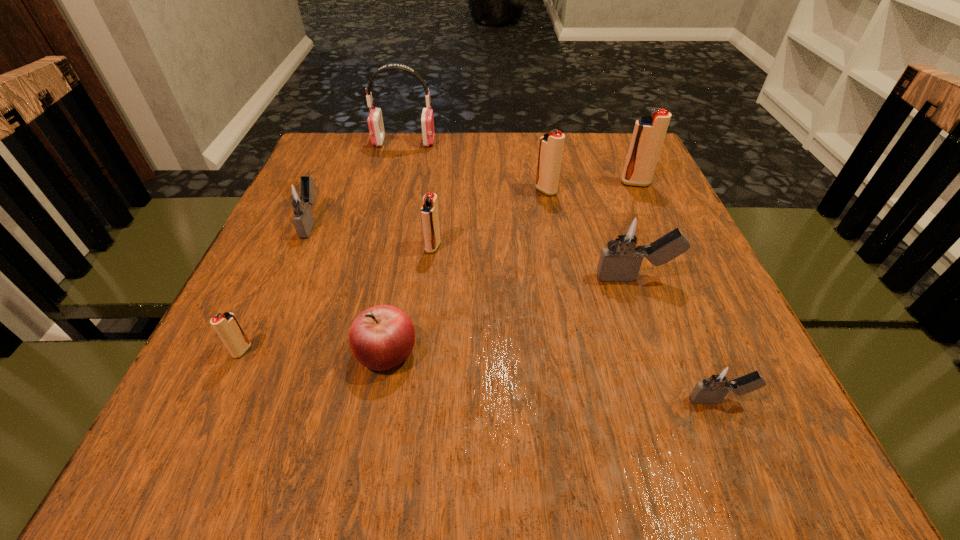
Locate which object ranks eighth in proximity to the fifth farthest igniter. Please provide its 2D coordinates. Your answer should be formatted as a tuple, i.e. [(x, y)], where the tuple contains the x and y coordinates of a point satisfying the conditions above.

[(226, 325)]

Locate an element on the screen. the sixth closest object relative to the nearest object is located at coordinates (226, 325).

Locate an element on the screen. The image size is (960, 540). igniter that can be found as the sixth closest to the second biggest gray igniter is located at coordinates (720, 378).

Select which igniter is the second closest to the pink earphone. Please provide its 2D coordinates. Your answer should be formatted as a tuple, i.e. [(x, y)], where the tuple contains the x and y coordinates of a point satisfying the conditions above.

[(551, 144)]

Where is `red igniter that is the third nearest to the apple`? red igniter that is the third nearest to the apple is located at coordinates (551, 144).

At what (x,y) coordinates should I click in order to perform the action: click on red igniter that is the third closest to the sixth nearest object. Please return your answer as a coordinate pair (x, y). This screenshot has height=540, width=960. Looking at the image, I should click on (551, 144).

Identify which gray igniter is located as the second nearest to the second smallest gray igniter. Please provide its 2D coordinates. Your answer should be formatted as a tuple, i.e. [(x, y)], where the tuple contains the x and y coordinates of a point satisfying the conditions above.

[(720, 378)]

Identify which gray igniter is the second closest to the fourth farthest object. Please provide its 2D coordinates. Your answer should be formatted as a tuple, i.e. [(x, y)], where the tuple contains the x and y coordinates of a point satisfying the conditions above.

[(720, 378)]

Locate an element on the screen. This screenshot has width=960, height=540. vacant region that satisfies the following two spatial constraints: 1. on the back side of the rightmost red igniter; 2. on the right side of the fifth farthest igniter is located at coordinates (602, 183).

The width and height of the screenshot is (960, 540). What are the coordinates of `free region that satisfies the following two spatial constraints: 1. on the outer surface of the farthest object; 2. on the right side of the second farthest gray igniter` in the screenshot? It's located at (371, 278).